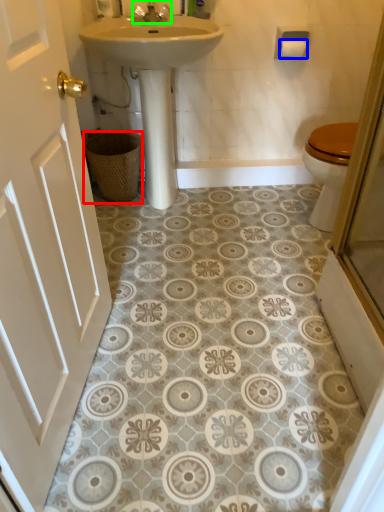
Question: Based on their relative distances, which object is nearer to basket (highlighted by a red box)? Choose from toilet paper (highlighted by a blue box) and tap (highlighted by a green box).

Choices:
 (A) toilet paper
 (B) tap

Answer: (B)